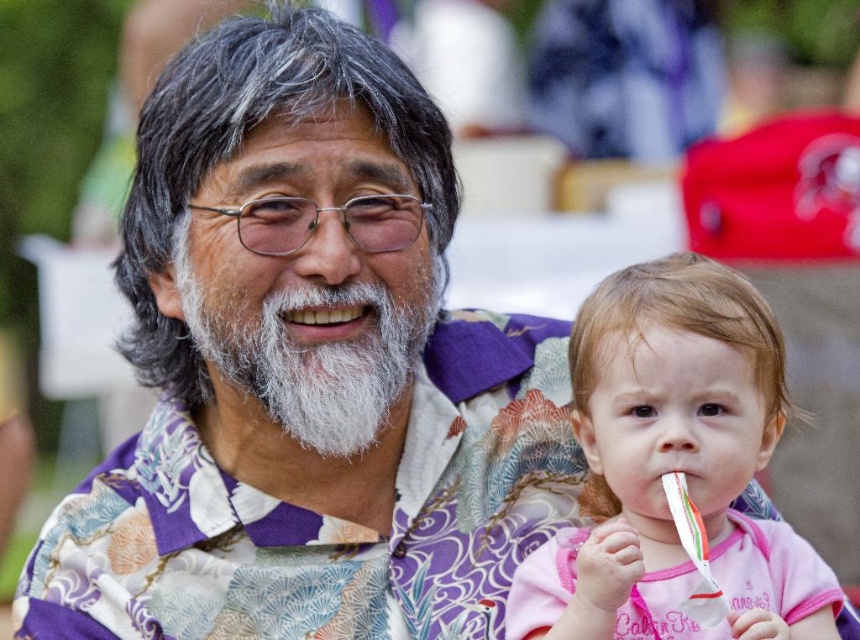
Based on the scene described, which object is bigger between the pink fabric at center and the white matte teeth at center?

The pink fabric at center is larger in size than the white matte teeth at center.

You are a photographer who needs to capture a closeup of the white plastic toothbrush at lower right without the pink fabric at center being visible in the shot. Is this possible given their relative sizes?

The pink fabric at center is much taller than the white plastic toothbrush at lower right, so it might block the view. You might need to adjust your angle or move closer to the toothbrush to avoid the fabric.

You are standing in front of the image and want to know which of the two points, point (711, 428) or point (329, 305), is nearer to you. Can you determine this based on their positions?

Point (711, 428) is closer to the viewer than point (329, 305), so yes, you can determine that point (711, 428) is nearer to you.